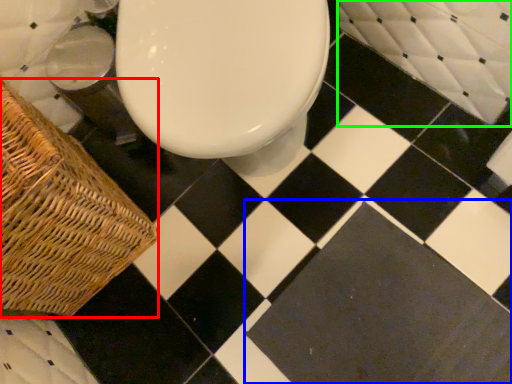
Question: Considering the real-world distances, which object is farthest from picnic basket (highlighted by a red box)? square (highlighted by a blue box) or bath (highlighted by a green box)?

Choices:
 (A) square
 (B) bath

Answer: (B)